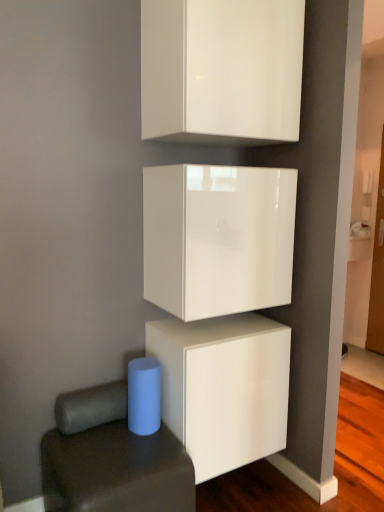
Question: Considering the relative positions of blue matte cylinder at lower left and white glossy cabinet at lower center, the third cabinetry in the top-to-bottom sequence, in the image provided, is blue matte cylinder at lower left to the left or to the right of white glossy cabinet at lower center, the third cabinetry in the top-to-bottom sequence,?

Choices:
 (A) right
 (B) left

Answer: (B)

Question: In terms of width, does blue matte cylinder at lower left look wider or thinner when compared to white glossy cabinet at lower center, the third cabinetry in the top-to-bottom sequence?

Choices:
 (A) thin
 (B) wide

Answer: (B)

Question: Which object is positioned closest to the glossy white cube at center, the second cabinetry from the top?

Choices:
 (A) white glossy cabinet at lower center, the 1th cabinetry positioned from the bottom
 (B) white glossy cabinet at upper center, the third cabinetry from the bottom
 (C) blue matte cylinder at lower left

Answer: (A)

Question: Which object is the closest to the white glossy cabinet at upper center, which is the first cabinetry in top-to-bottom order?

Choices:
 (A) white glossy cabinet at lower center, the third cabinetry in the top-to-bottom sequence
 (B) blue matte cylinder at lower left
 (C) glossy white cube at center, the second cabinetry when ordered from bottom to top

Answer: (C)